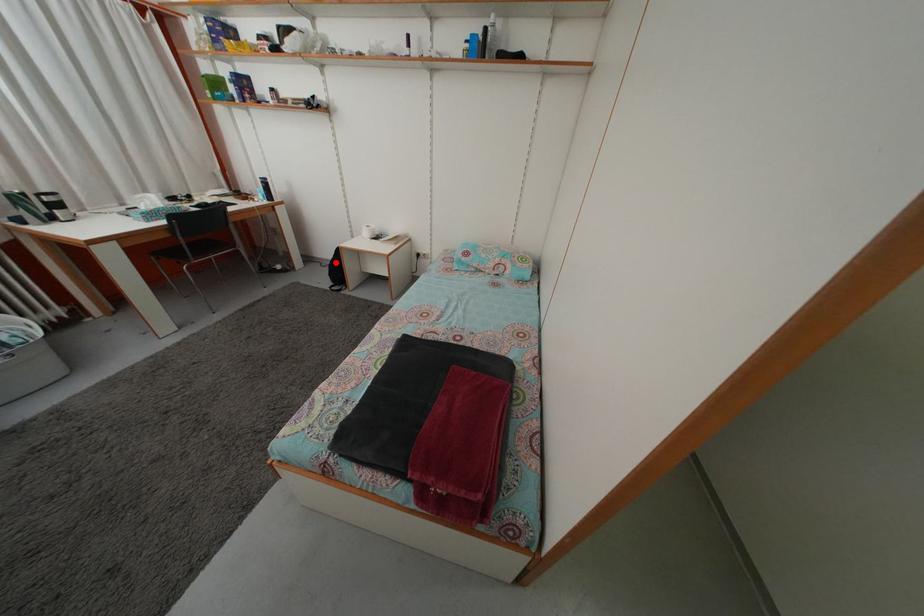
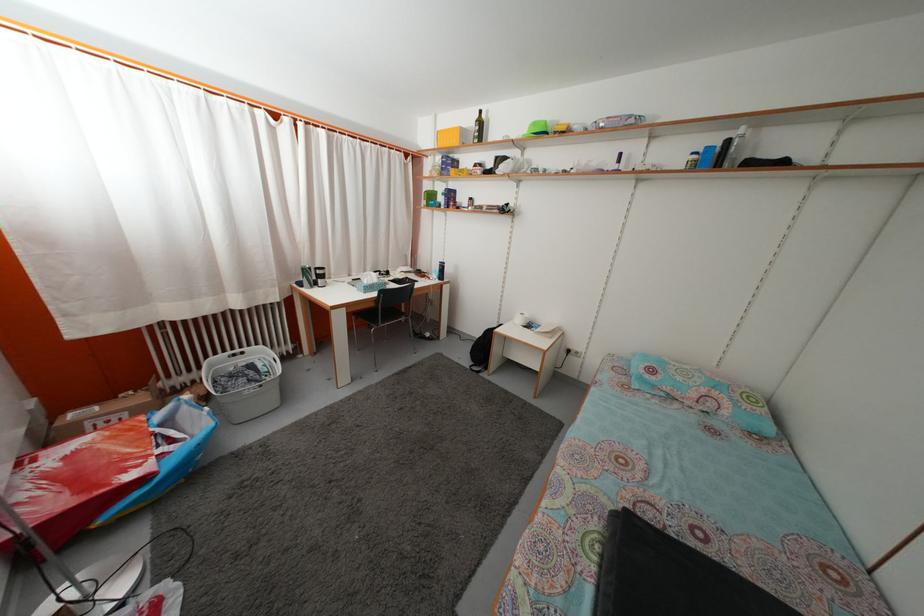
Locate, in the second image, the point that corresponds to the highlighted location in the first image.

(482, 342)